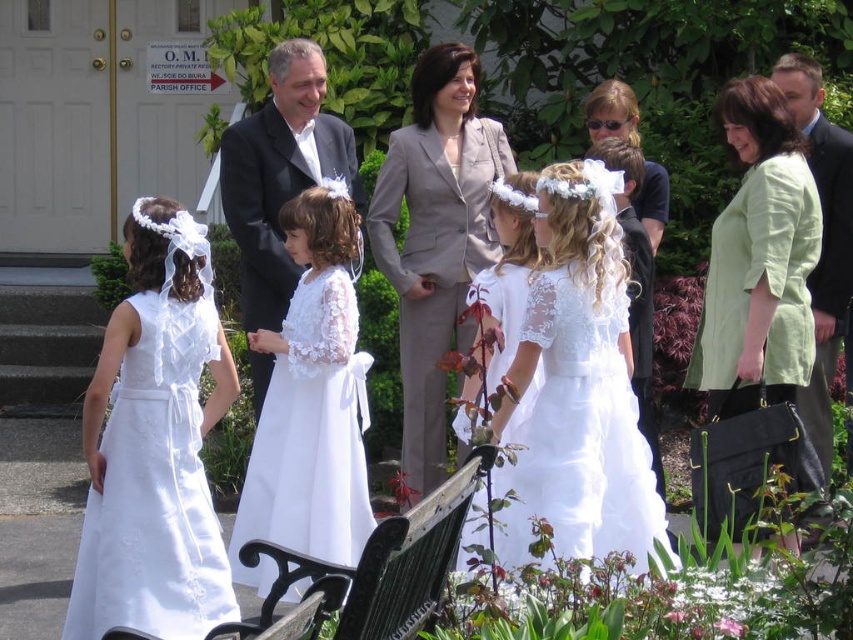
You are standing at the entrance of the building and see the point marked at coordinates (279, 173). What object is located at that point?

The point at coordinates (279, 173) marks the location of the matte black suit at center.